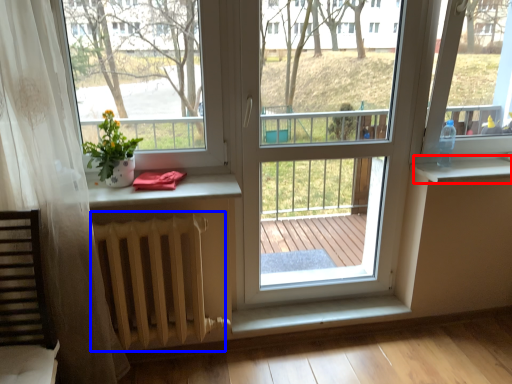
Question: Among these objects, which one is nearest to the camera, window sill (highlighted by a red box) or radiator (highlighted by a blue box)?

Choices:
 (A) window sill
 (B) radiator

Answer: (B)